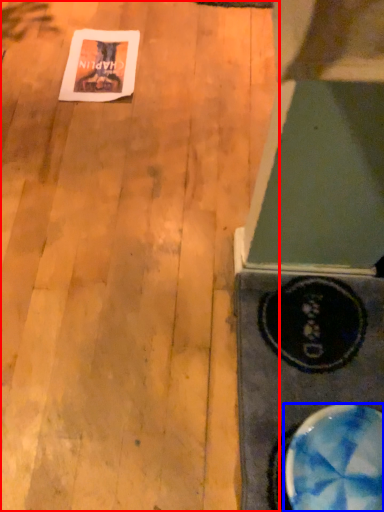
Question: Among these objects, which one is nearest to the camera, plywood (highlighted by a red box) or bowl (highlighted by a blue box)?

Choices:
 (A) plywood
 (B) bowl

Answer: (B)